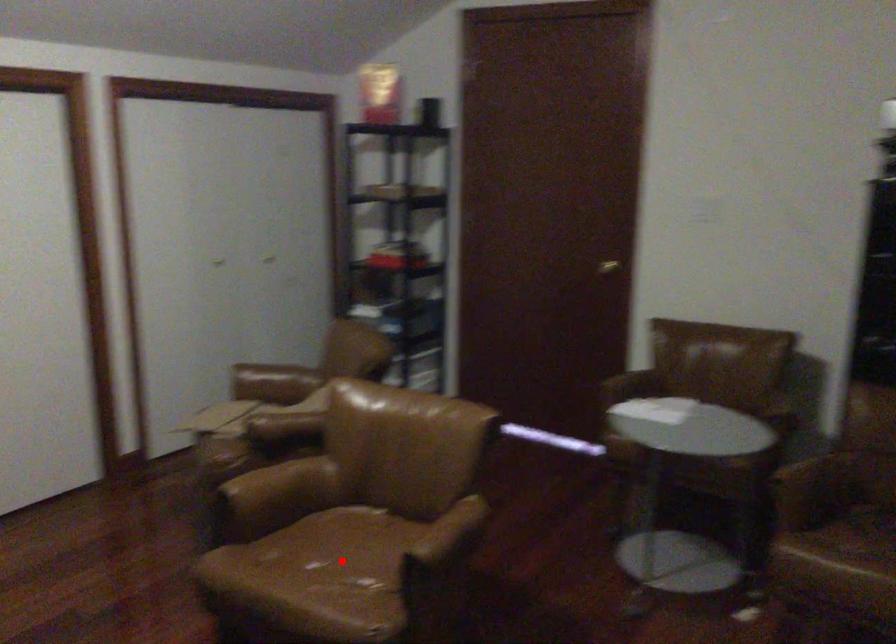
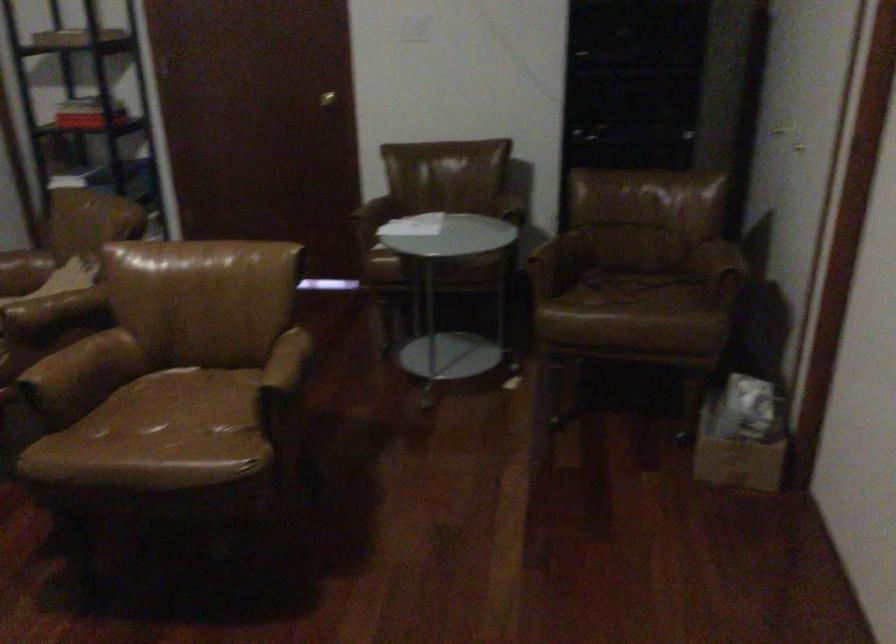
The point at the highlighted location is marked in the first image. Where is the corresponding point in the second image?

(178, 413)